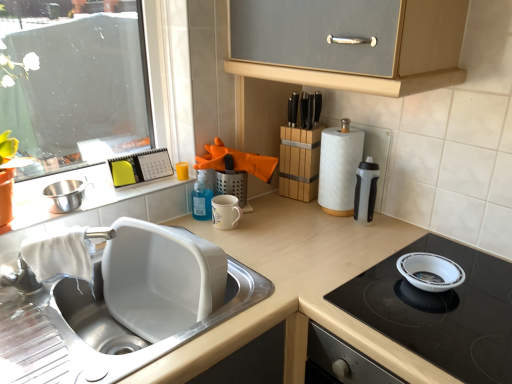
Locate an element on the screen. This screenshot has height=384, width=512. vacant space situated above white glossy window sill at upper left (from a real-world perspective) is located at coordinates (100, 197).